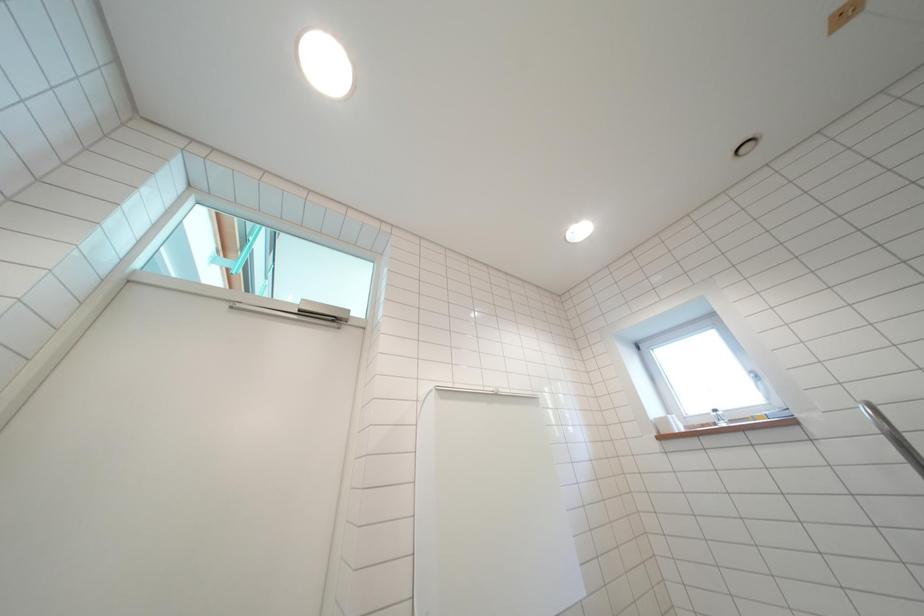
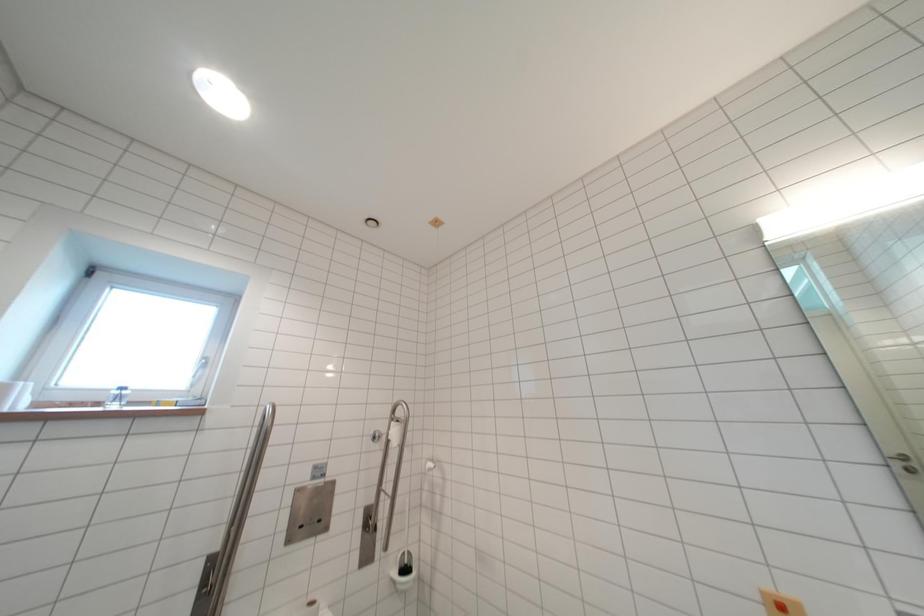
How did the camera likely rotate?

The camera rotated toward right-up.